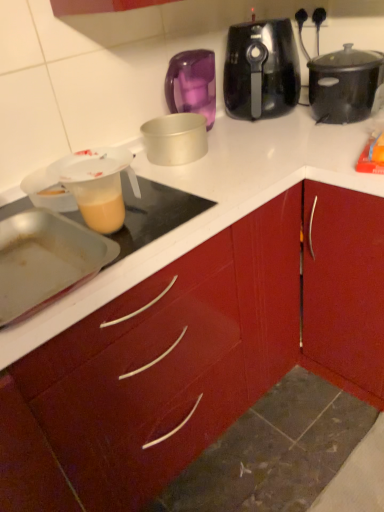
You are a GUI agent. You are given a task and a screenshot of the screen. Output one action in this format:
    pyautogui.click(x=<x>, y=<y>)
    Task: Click on the free point to the right of metallic silver baking pan at left, the 1th kitchen appliance ordered from the bottom
    
    Given the screenshot: What is the action you would take?
    pyautogui.click(x=170, y=221)